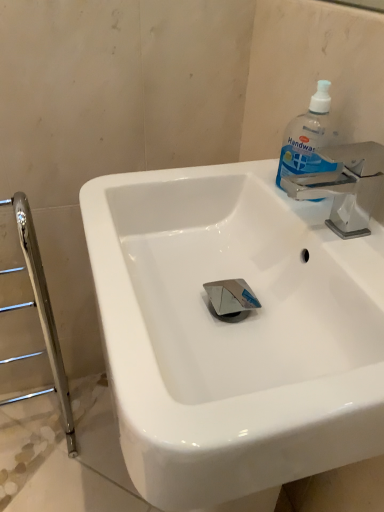
The height and width of the screenshot is (512, 384). What do you see at coordinates (308, 138) in the screenshot?
I see `transparent plastic handwash at upper right` at bounding box center [308, 138].

Identify the location of transparent plastic handwash at upper right. (308, 138).

Consider the image. Measure the distance between white glossy sink at center and camera.

white glossy sink at center and camera are 13.71 inches apart from each other.

Find the location of a particular element. white glossy sink at center is located at coordinates (233, 333).

What do you see at coordinates (233, 333) in the screenshot?
I see `white glossy sink at center` at bounding box center [233, 333].

What is the approximate width of white glossy sink at center?

white glossy sink at center is 17.06 inches in width.

Where is `transparent plastic handwash at upper right`? The width and height of the screenshot is (384, 512). transparent plastic handwash at upper right is located at coordinates click(308, 138).

Which object is positioned more to the left, white glossy sink at center or transparent plastic handwash at upper right?

white glossy sink at center.

Based on the photo, is the depth of white glossy sink at center less than that of transparent plastic handwash at upper right?

Yes, the depth of white glossy sink at center is less than that of transparent plastic handwash at upper right.

Considering the positions of point (205, 280) and point (320, 92), is point (205, 280) closer or farther from the camera than point (320, 92)?

Point (205, 280) is positioned farther from the camera compared to point (320, 92).

From the image's perspective, which is above, white glossy sink at center or transparent plastic handwash at upper right?

transparent plastic handwash at upper right.

From a real-world perspective, is white glossy sink at center positioned above or below transparent plastic handwash at upper right?

Clearly, from a real-world perspective, white glossy sink at center is below transparent plastic handwash at upper right.

Looking at their sizes, would you say white glossy sink at center is wider or thinner than transparent plastic handwash at upper right?

white glossy sink at center is wider than transparent plastic handwash at upper right.

Based on the photo, can you confirm if white glossy sink at center is taller than transparent plastic handwash at upper right?

Correct, white glossy sink at center is much taller as transparent plastic handwash at upper right.

Does white glossy sink at center have a larger size compared to transparent plastic handwash at upper right?

Yes.

Does white glossy sink at center contain transparent plastic handwash at upper right?

Indeed, transparent plastic handwash at upper right is located within white glossy sink at center.

Is white glossy sink at center next to transparent plastic handwash at upper right and touching it?

No.

Is white glossy sink at center aimed at transparent plastic handwash at upper right?

No, white glossy sink at center does not turn towards transparent plastic handwash at upper right.

Where is `cleaning product above the white glossy sink at center (from the image's perspective)`? cleaning product above the white glossy sink at center (from the image's perspective) is located at coordinates (308, 138).

Between transparent plastic handwash at upper right and white glossy sink at center, which one appears on the right side from the viewer's perspective?

transparent plastic handwash at upper right is more to the right.

Is the depth of transparent plastic handwash at upper right less than that of white glossy sink at center?

No, it is behind white glossy sink at center.

Between point (304, 124) and point (332, 390), which one is positioned in front?

The point (332, 390) is closer.

From the image's perspective, is transparent plastic handwash at upper right above or below white glossy sink at center?

transparent plastic handwash at upper right is situated higher than white glossy sink at center in the image.

From a real-world perspective, which is physically above, transparent plastic handwash at upper right or white glossy sink at center?

From a 3D spatial view, transparent plastic handwash at upper right is above.

Which of these two, transparent plastic handwash at upper right or white glossy sink at center, is wider?

Wider between the two is white glossy sink at center.

Who is shorter, transparent plastic handwash at upper right or white glossy sink at center?

transparent plastic handwash at upper right.

Is transparent plastic handwash at upper right bigger than white glossy sink at center?

Incorrect, transparent plastic handwash at upper right is not larger than white glossy sink at center.

Would you say transparent plastic handwash at upper right is inside or outside white glossy sink at center?

transparent plastic handwash at upper right is spatially positioned inside white glossy sink at center.

Is transparent plastic handwash at upper right next to white glossy sink at center?

No, transparent plastic handwash at upper right is not with white glossy sink at center.

Could you tell me if transparent plastic handwash at upper right is facing white glossy sink at center?

Yes, transparent plastic handwash at upper right is facing white glossy sink at center.

What's the angular difference between transparent plastic handwash at upper right and white glossy sink at center's facing directions?

They differ by 1.21 degrees in their facing directions.

Locate an element on the screen. This screenshot has width=384, height=512. sink located underneath the transparent plastic handwash at upper right (from a real-world perspective) is located at coordinates (233, 333).

Image resolution: width=384 pixels, height=512 pixels. I want to click on cleaning product above the white glossy sink at center (from a real-world perspective), so click(308, 138).

This screenshot has height=512, width=384. Find the location of `cleaning product that is on the right side of white glossy sink at center`. cleaning product that is on the right side of white glossy sink at center is located at coordinates (308, 138).